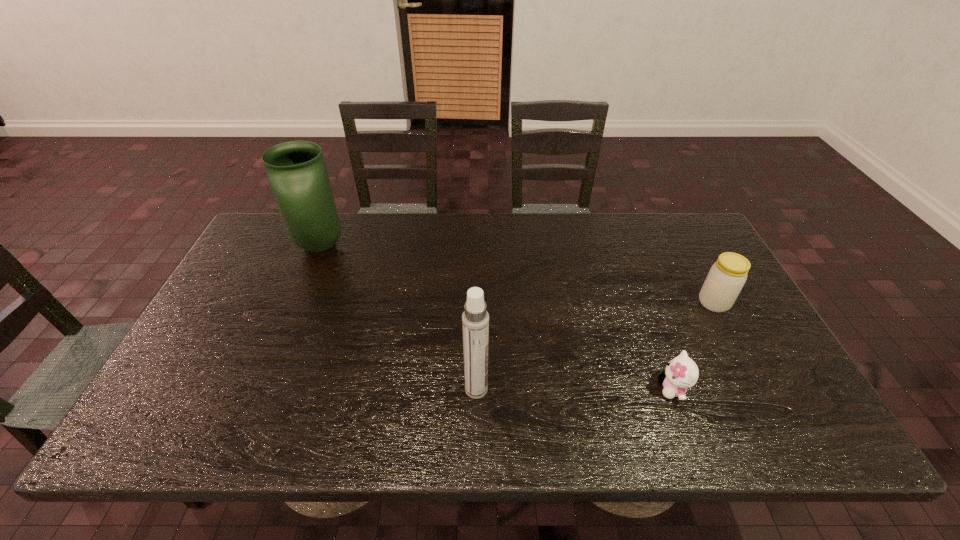
Where is `vacant space at the right edge of the desktop`? The image size is (960, 540). vacant space at the right edge of the desktop is located at coordinates (689, 291).

This screenshot has width=960, height=540. In order to click on blank region between the third object from left to right and the second object from left to right in this screenshot , I will do `click(575, 389)`.

Find the location of a particular element. The image size is (960, 540). unoccupied position between the farthest object and the third object from right to left is located at coordinates (398, 318).

Where is `blank region between the leftmost object and the rightmost object`? The image size is (960, 540). blank region between the leftmost object and the rightmost object is located at coordinates (517, 274).

What are the coordinates of `free space between the second object from right to left and the second object from left to right` in the screenshot? It's located at (575, 389).

You are a GUI agent. You are given a task and a screenshot of the screen. Output one action in this format:
    pyautogui.click(x=<x>, y=<y>)
    Task: Click on the free spot between the farthest object and the aerosol can
    The image size is (960, 540).
    Given the screenshot: What is the action you would take?
    pyautogui.click(x=398, y=318)

What are the coordinates of `free space between the vase and the third object from right to left` in the screenshot? It's located at (398, 318).

The height and width of the screenshot is (540, 960). I want to click on free spot between the aerosol can and the leftmost object, so click(x=398, y=318).

The height and width of the screenshot is (540, 960). I want to click on vacant area that lies between the jar and the shortest object, so click(693, 346).

This screenshot has width=960, height=540. Identify the location of vacant point located between the aerosol can and the kitten. (575, 389).